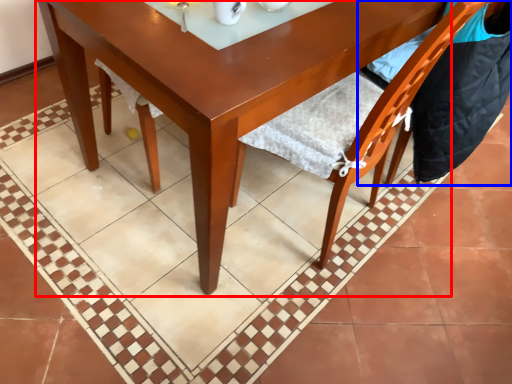
Question: Which of the following is the closest to the observer, round table (highlighted by a red box) or chair (highlighted by a blue box)?

Choices:
 (A) round table
 (B) chair

Answer: (A)